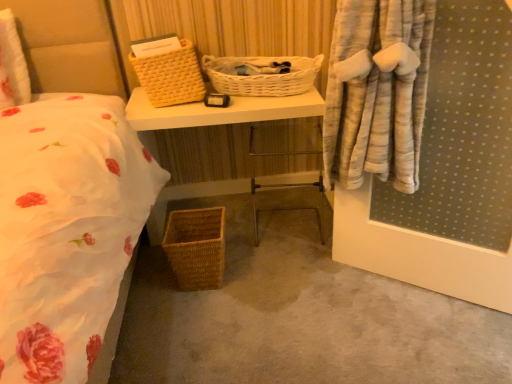
Question: Which direction should I rotate to look at white wicker picnic basket at center, marked as the second picnic basket in a bottom-to-top arrangement, — up or down?

Choices:
 (A) down
 (B) up

Answer: (B)

Question: Is matte wicker basket at center at the right side of white wicker picnic basket at center, marked as the second picnic basket in a bottom-to-top arrangement?

Choices:
 (A) no
 (B) yes

Answer: (A)

Question: Is matte wicker basket at center to the left of white wicker picnic basket at center, marked as the second picnic basket in a bottom-to-top arrangement, from the viewer's perspective?

Choices:
 (A) yes
 (B) no

Answer: (A)

Question: Is matte wicker basket at center oriented away from white wicker picnic basket at center, the second picnic basket when ordered from top to bottom?

Choices:
 (A) no
 (B) yes

Answer: (A)

Question: Is matte wicker basket at center completely or partially outside of white wicker picnic basket at center, marked as the second picnic basket in a bottom-to-top arrangement?

Choices:
 (A) yes
 (B) no

Answer: (A)

Question: Could you tell me if matte wicker basket at center is turned towards white wicker picnic basket at center, the second picnic basket when ordered from top to bottom?

Choices:
 (A) no
 (B) yes

Answer: (A)

Question: From the image's perspective, is matte wicker basket at center beneath white wicker picnic basket at center, marked as the second picnic basket in a bottom-to-top arrangement?

Choices:
 (A) no
 (B) yes

Answer: (B)

Question: Considering the relative sizes of white wicker picnic basket at center, marked as the second picnic basket in a bottom-to-top arrangement, and metallic silver chair at center in the image provided, is white wicker picnic basket at center, marked as the second picnic basket in a bottom-to-top arrangement, thinner than metallic silver chair at center?

Choices:
 (A) no
 (B) yes

Answer: (A)

Question: Is white wicker picnic basket at center, the second picnic basket when ordered from top to bottom, at the right side of metallic silver chair at center?

Choices:
 (A) no
 (B) yes

Answer: (A)

Question: Is white wicker picnic basket at center, the second picnic basket when ordered from top to bottom, oriented towards metallic silver chair at center?

Choices:
 (A) yes
 (B) no

Answer: (B)

Question: Is metallic silver chair at center at the back of white wicker picnic basket at center, the second picnic basket when ordered from top to bottom?

Choices:
 (A) no
 (B) yes

Answer: (A)

Question: Is metallic silver chair at center located within white wicker picnic basket at center, the second picnic basket when ordered from top to bottom?

Choices:
 (A) no
 (B) yes

Answer: (A)

Question: Is white wicker picnic basket at center, marked as the second picnic basket in a bottom-to-top arrangement, positioned in front of metallic silver chair at center?

Choices:
 (A) no
 (B) yes

Answer: (B)

Question: Is yellow woven picnic basket at upper center, the 3th picnic basket positioned from the bottom, not near woven brown picnic basket at lower center, the 1th picnic basket from the bottom?

Choices:
 (A) no
 (B) yes

Answer: (A)